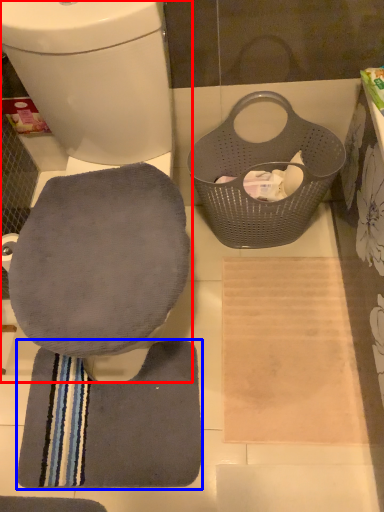
Question: Which point is closer to the camera, toilet (highlighted by a red box) or bath towel (highlighted by a blue box)?

Choices:
 (A) toilet
 (B) bath towel

Answer: (A)